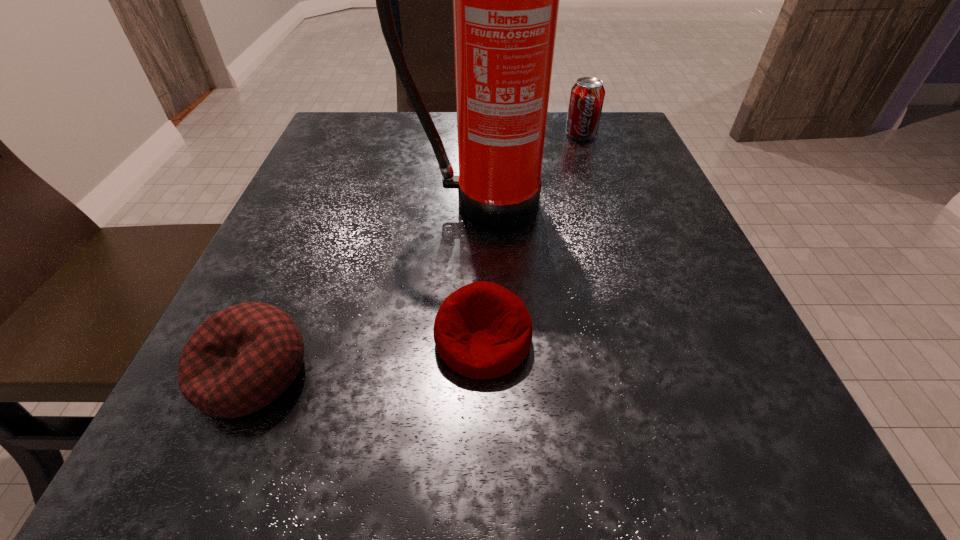
You are a GUI agent. You are given a task and a screenshot of the screen. Output one action in this format:
    pyautogui.click(x=<x>, y=<y>)
    Task: Click on the free space between the third shortest object and the leftmost object
    
    Given the screenshot: What is the action you would take?
    pyautogui.click(x=417, y=253)

Where is `vacant area that lies between the farthest object and the right beanbag`? The image size is (960, 540). vacant area that lies between the farthest object and the right beanbag is located at coordinates (532, 237).

Where is `free space that is in between the right beanbag and the leftmost object`? free space that is in between the right beanbag and the leftmost object is located at coordinates (368, 356).

You are a GUI agent. You are given a task and a screenshot of the screen. Output one action in this format:
    pyautogui.click(x=<x>, y=<y>)
    Task: Click on the free space between the leftmost object and the right beanbag
    
    Given the screenshot: What is the action you would take?
    pyautogui.click(x=368, y=356)

At what (x,y) coordinates should I click in order to perform the action: click on free space between the right beanbag and the left beanbag. Please return your answer as a coordinate pair (x, y). Looking at the image, I should click on (368, 356).

Locate an element on the screen. The image size is (960, 540). free space between the second farthest object and the leftmost object is located at coordinates (366, 288).

You are a GUI agent. You are given a task and a screenshot of the screen. Output one action in this format:
    pyautogui.click(x=<x>, y=<y>)
    Task: Click on the free area in between the rightmost object and the leftmost object
    The width and height of the screenshot is (960, 540).
    Given the screenshot: What is the action you would take?
    pyautogui.click(x=417, y=253)

Locate an element on the screen. blank region between the leftmost object and the farthest object is located at coordinates (417, 253).

Locate an element on the screen. The width and height of the screenshot is (960, 540). vacant area that lies between the left beanbag and the tallest object is located at coordinates (366, 288).

Image resolution: width=960 pixels, height=540 pixels. In order to click on vacant area that lies between the second tallest object and the right beanbag in this screenshot , I will do `click(532, 237)`.